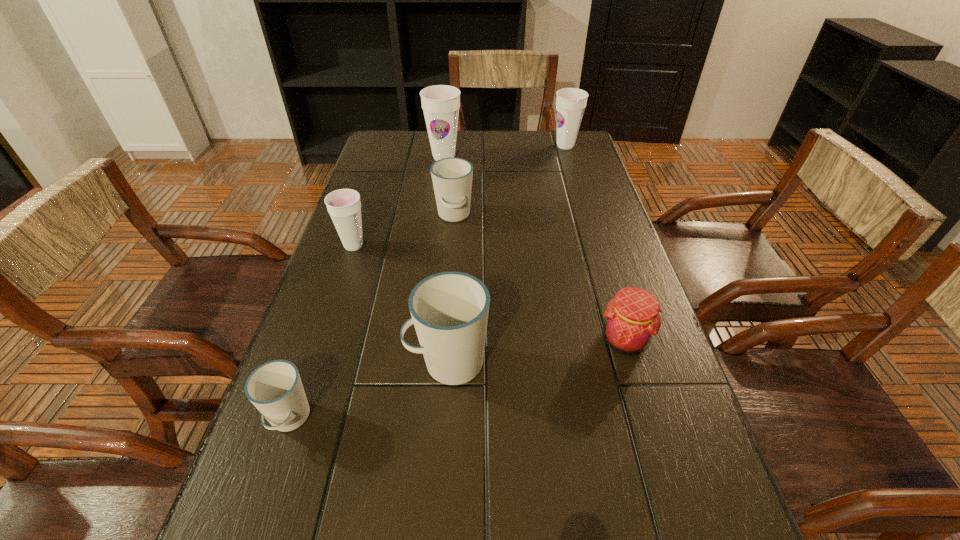
In order to click on free space located on the back of the red jam in this screenshot , I will do `click(611, 294)`.

Locate an element on the screen. This screenshot has width=960, height=540. free spot located 0.090m with a handle on the side of the nearest white cup is located at coordinates (261, 502).

Where is `cup positioned at the right edge`? This screenshot has width=960, height=540. cup positioned at the right edge is located at coordinates (570, 102).

Where is `jam that is at the right edge`? jam that is at the right edge is located at coordinates tap(632, 319).

Identify the location of object situated at the far right corner. Image resolution: width=960 pixels, height=540 pixels. (570, 102).

The height and width of the screenshot is (540, 960). Find the location of `vacant space at the far edge of the desktop`. vacant space at the far edge of the desktop is located at coordinates (468, 144).

You are a GUI agent. You are given a task and a screenshot of the screen. Output one action in this format:
    pyautogui.click(x=<x>, y=<y>)
    Task: Click on the free space at the left edge of the desktop
    The width and height of the screenshot is (960, 540).
    Given the screenshot: What is the action you would take?
    pyautogui.click(x=349, y=421)

Where is `vacant space at the right edge of the desktop`? vacant space at the right edge of the desktop is located at coordinates [x=617, y=390].

In the image, there is a desktop. Where is `free space at the far right corner`? free space at the far right corner is located at coordinates (556, 153).

Where is `free space between the fifth farthest cup and the second biggest purple cup`? free space between the fifth farthest cup and the second biggest purple cup is located at coordinates (507, 254).